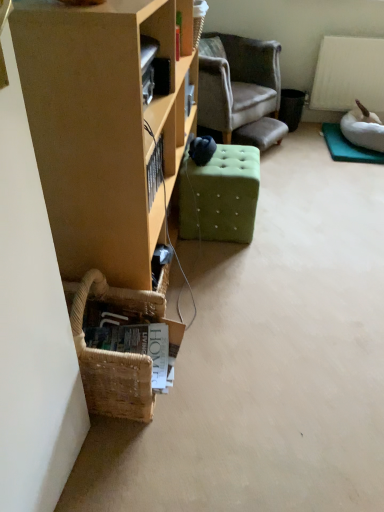
Locate an element on the screen. vacant area located to the right-hand side of green tufted ottoman at center is located at coordinates (292, 224).